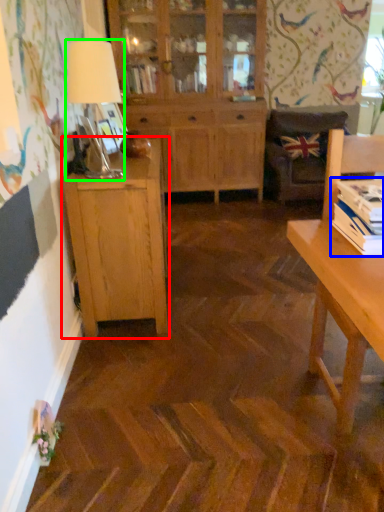
Question: Considering the real-world distances, which object is closest to cabinetry (highlighted by a red box)? book (highlighted by a blue box) or table lamp (highlighted by a green box).

Choices:
 (A) book
 (B) table lamp

Answer: (B)